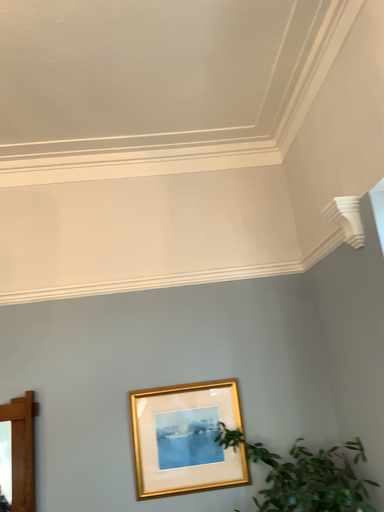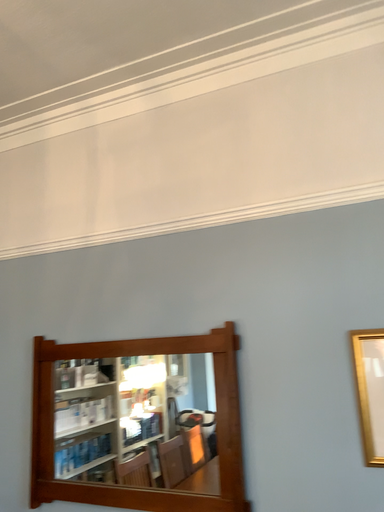
Question: How did the camera likely rotate when shooting the video?

Choices:
 (A) rotated left
 (B) rotated right

Answer: (A)